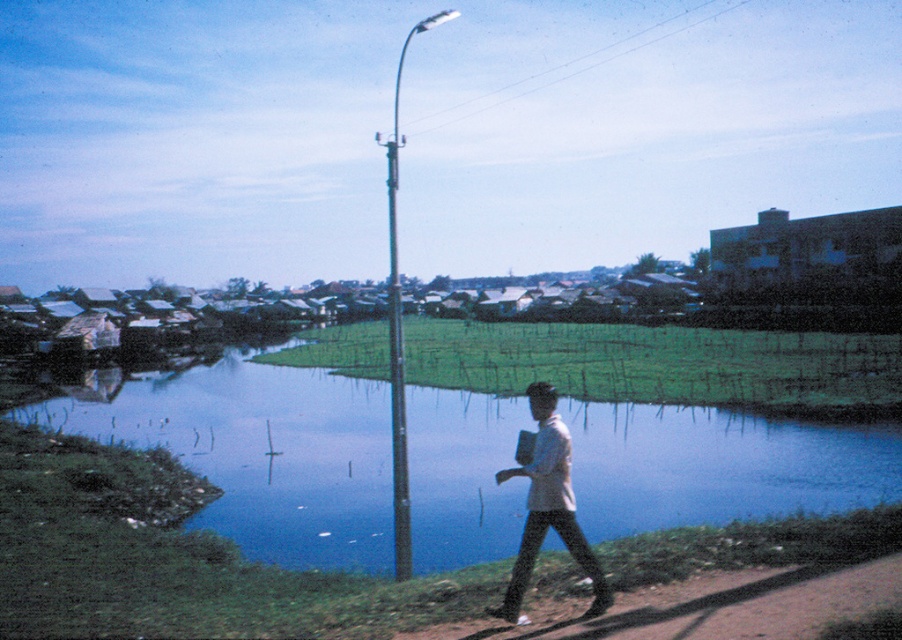
Question: Can you confirm if brown dirt path at lower right is smaller than metallic gray pole at center?

Choices:
 (A) no
 (B) yes

Answer: (B)

Question: Among these objects, which one is farthest from the camera?

Choices:
 (A) blue water at center
 (B) white fabric shirt at center

Answer: (A)

Question: Does blue water at center have a smaller size compared to brown dirt path at lower right?

Choices:
 (A) yes
 (B) no

Answer: (B)

Question: Does blue water at center lie behind white fabric shirt at center?

Choices:
 (A) yes
 (B) no

Answer: (A)

Question: Which point is closer to the camera?

Choices:
 (A) coord(394,328)
 (B) coord(785,486)
 (C) coord(403,467)

Answer: (C)

Question: Among these points, which one is nearest to the camera?

Choices:
 (A) (136, 420)
 (B) (493, 621)
 (C) (536, 504)

Answer: (C)